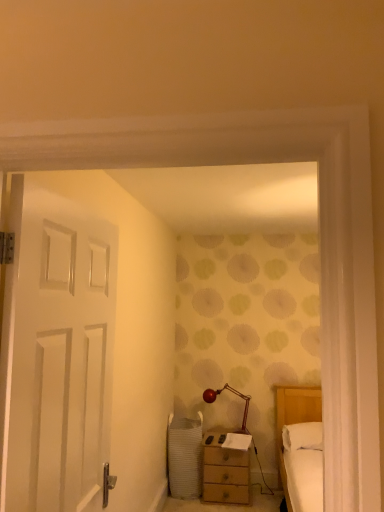
Question: Is white soft pillow at right positioned before wooden nightstand at lower center?

Choices:
 (A) no
 (B) yes

Answer: (B)

Question: Can wooden nightstand at lower center be found inside white soft pillow at right?

Choices:
 (A) yes
 (B) no

Answer: (B)

Question: Is white soft pillow at right to the right of wooden nightstand at lower center from the viewer's perspective?

Choices:
 (A) yes
 (B) no

Answer: (A)

Question: Is white soft pillow at right bigger than wooden nightstand at lower center?

Choices:
 (A) yes
 (B) no

Answer: (B)

Question: Is white soft pillow at right completely or partially outside of wooden nightstand at lower center?

Choices:
 (A) no
 (B) yes

Answer: (B)

Question: Does point (221, 463) appear closer or farther from the camera than point (309, 440)?

Choices:
 (A) farther
 (B) closer

Answer: (A)

Question: Is wooden nightstand at lower center to the left or to the right of white soft pillow at right in the image?

Choices:
 (A) right
 (B) left

Answer: (B)

Question: Is wooden nightstand at lower center in front of or behind white soft pillow at right in the image?

Choices:
 (A) front
 (B) behind

Answer: (B)

Question: From a real-world perspective, is wooden nightstand at lower center above or below white soft pillow at right?

Choices:
 (A) above
 (B) below

Answer: (B)

Question: From their relative heights in the image, would you say wooden nightstand at lower center is taller or shorter than shiny red glass table lamp at center?

Choices:
 (A) short
 (B) tall

Answer: (B)

Question: Considering the relative positions of wooden nightstand at lower center and shiny red glass table lamp at center in the image provided, is wooden nightstand at lower center to the left or to the right of shiny red glass table lamp at center?

Choices:
 (A) left
 (B) right

Answer: (A)

Question: Considering their positions, is wooden nightstand at lower center located in front of or behind shiny red glass table lamp at center?

Choices:
 (A) front
 (B) behind

Answer: (A)

Question: From the image's perspective, is wooden nightstand at lower center located above or below shiny red glass table lamp at center?

Choices:
 (A) below
 (B) above

Answer: (A)

Question: Considering the positions of shiny red glass table lamp at center and white soft pillow at right in the image, is shiny red glass table lamp at center bigger or smaller than white soft pillow at right?

Choices:
 (A) big
 (B) small

Answer: (B)

Question: Is shiny red glass table lamp at center wider or thinner than white soft pillow at right?

Choices:
 (A) wide
 (B) thin

Answer: (B)